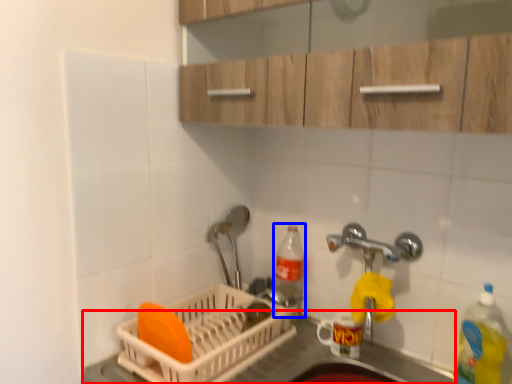
Question: Which point is further to the camera, counter top (highlighted by a red box) or bottle (highlighted by a blue box)?

Choices:
 (A) counter top
 (B) bottle

Answer: (B)